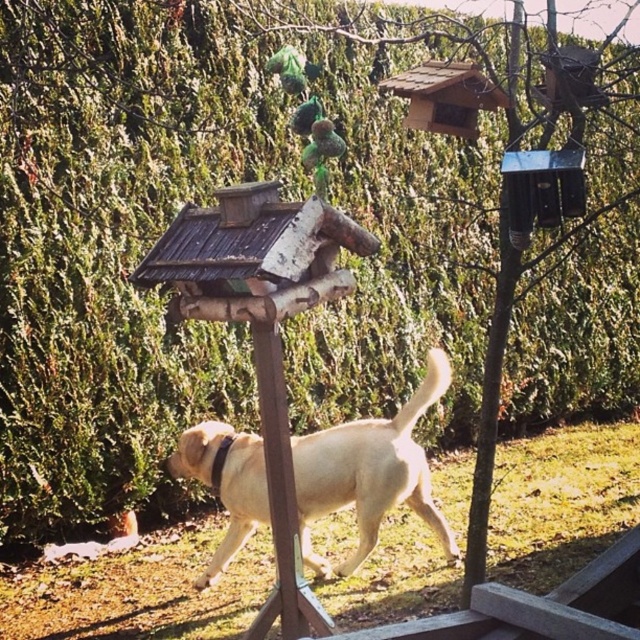
Can you confirm if wooden bird feeder at upper center is positioned to the left of green matte ornament at upper center?

In fact, wooden bird feeder at upper center is to the right of green matte ornament at upper center.

Which of these two, wooden bird feeder at upper center or green matte ornament at upper center, stands taller?

With more height is wooden bird feeder at upper center.

Does point (465, 88) lie in front of point (291, 61)?

No, it is not.

Where is `wooden bird feeder at upper center`? The height and width of the screenshot is (640, 640). wooden bird feeder at upper center is located at coordinates (445, 97).

Can you confirm if light yellow fur at center is taller than brown wooden pole at center?

No, light yellow fur at center is not taller than brown wooden pole at center.

Based on the photo, is light yellow fur at center positioned behind brown wooden pole at center?

Yes, light yellow fur at center is behind brown wooden pole at center.

This screenshot has width=640, height=640. I want to click on light yellow fur at center, so click(x=369, y=472).

Can you confirm if wooden bird feeder at upper center is smaller than green matte bird at center?

No.

Measure the distance between point [468,134] and camera.

A distance of 4.01 meters exists between point [468,134] and camera.

This screenshot has height=640, width=640. Describe the element at coordinates (445, 97) in the screenshot. I see `wooden bird feeder at upper center` at that location.

Find the location of a particular element. wooden bird feeder at upper center is located at coordinates (445, 97).